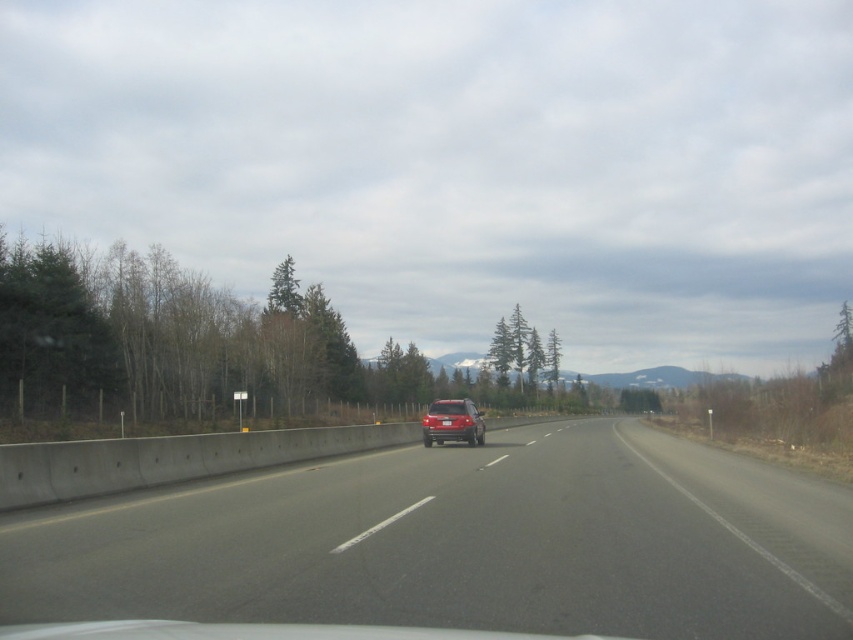
In the scene shown: Does smooth asphalt road at center have a greater width compared to satin red suv at center?

Yes, smooth asphalt road at center is wider than satin red suv at center.

The image size is (853, 640). Find the location of `smooth asphalt road at center`. smooth asphalt road at center is located at coordinates (463, 544).

Locate an element on the screen. smooth asphalt road at center is located at coordinates (463, 544).